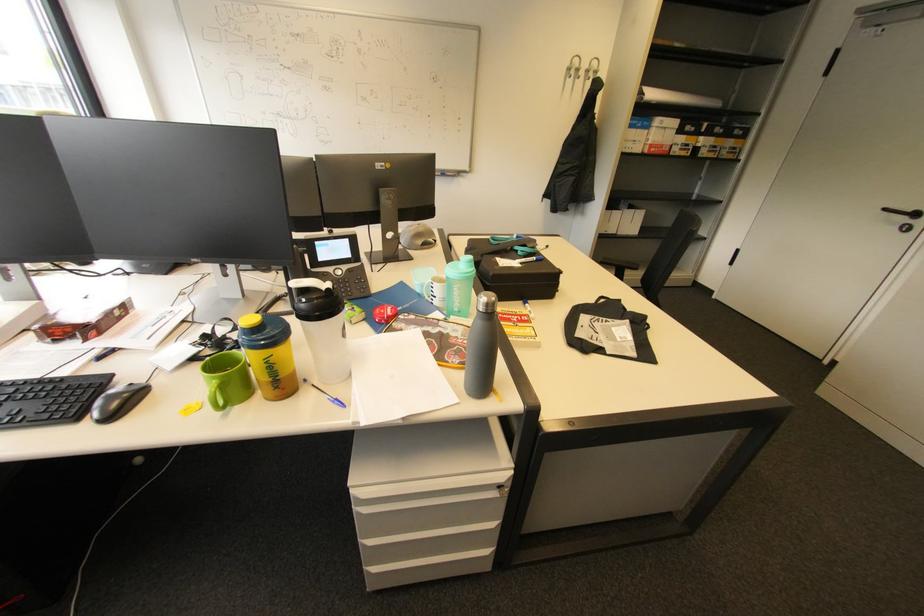
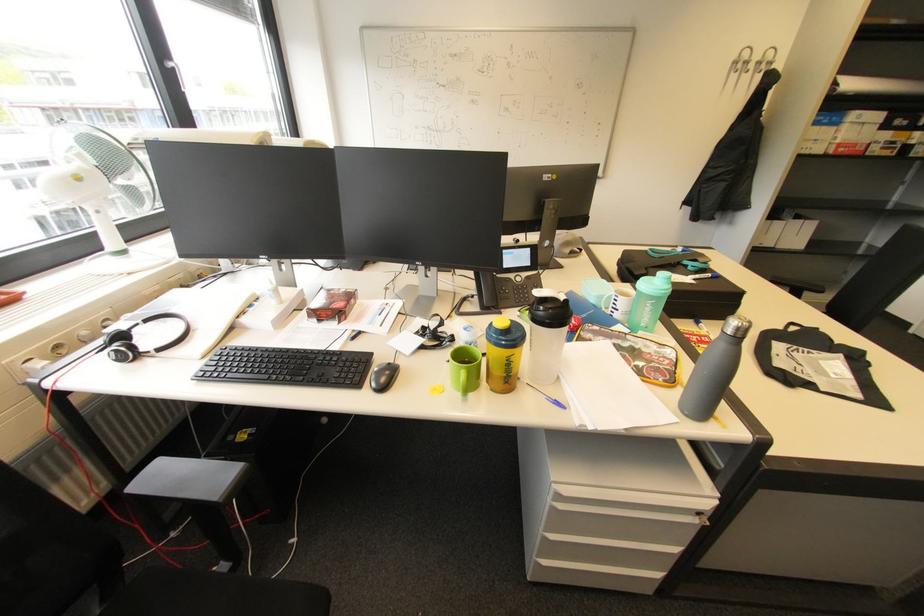
In the second image, find the point that corresponds to the point at 448,317 in the first image.

(635, 331)